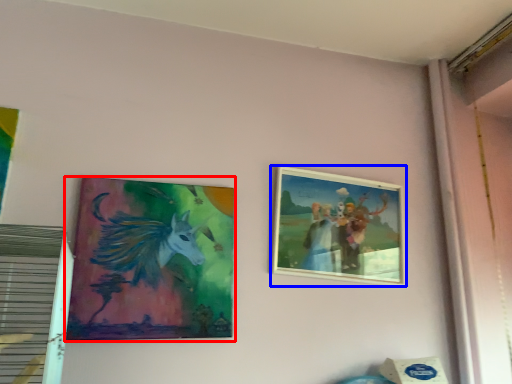
Question: Among these objects, which one is nearest to the camera, picture frame (highlighted by a red box) or picture frame (highlighted by a blue box)?

Choices:
 (A) picture frame
 (B) picture frame

Answer: (A)